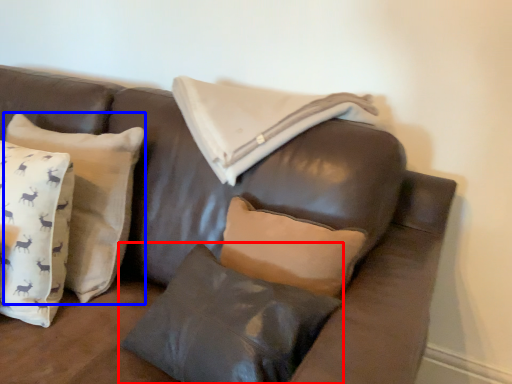
Question: Which object is closer to the camera taking this photo, pillow (highlighted by a red box) or pillow (highlighted by a blue box)?

Choices:
 (A) pillow
 (B) pillow

Answer: (A)